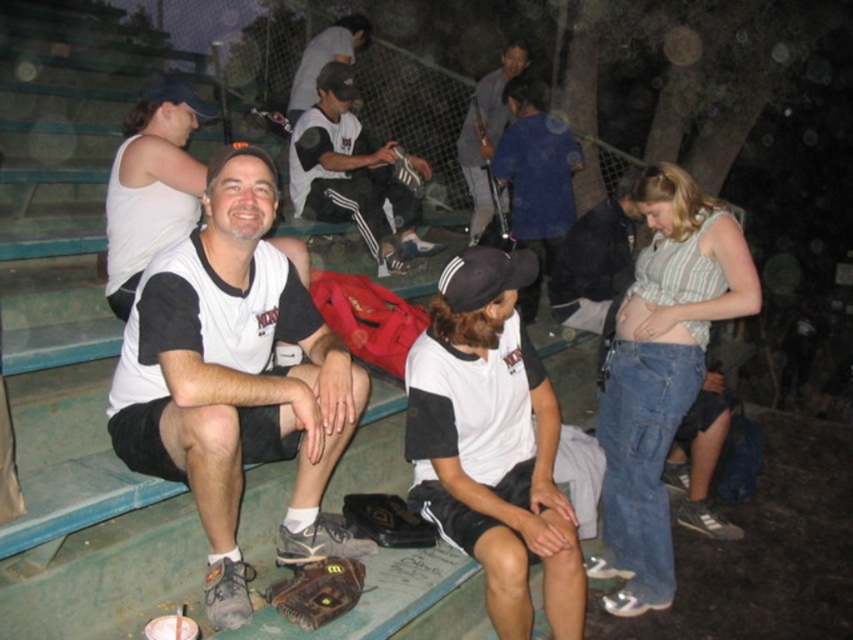
Question: Which point appears farthest from the camera in this image?

Choices:
 (A) (326, 54)
 (B) (558, 528)
 (C) (181, 180)

Answer: (A)

Question: Does matte white shirt at center appear over brown leather baseball glove at lower center?

Choices:
 (A) no
 (B) yes

Answer: (B)

Question: Which point is farther from the camera taking this photo?

Choices:
 (A) (200, 449)
 (B) (299, 620)

Answer: (B)

Question: Can you confirm if matte white shirt at center is positioned above dark gray fabric jacket at center?

Choices:
 (A) yes
 (B) no

Answer: (B)

Question: In this image, where is white matte shirt at center located relative to white cotton shirt at center?

Choices:
 (A) right
 (B) left

Answer: (A)

Question: Among these objects, which one is nearest to the camera?

Choices:
 (A) dark gray fabric jacket at center
 (B) white matte baseball cap at center

Answer: (B)